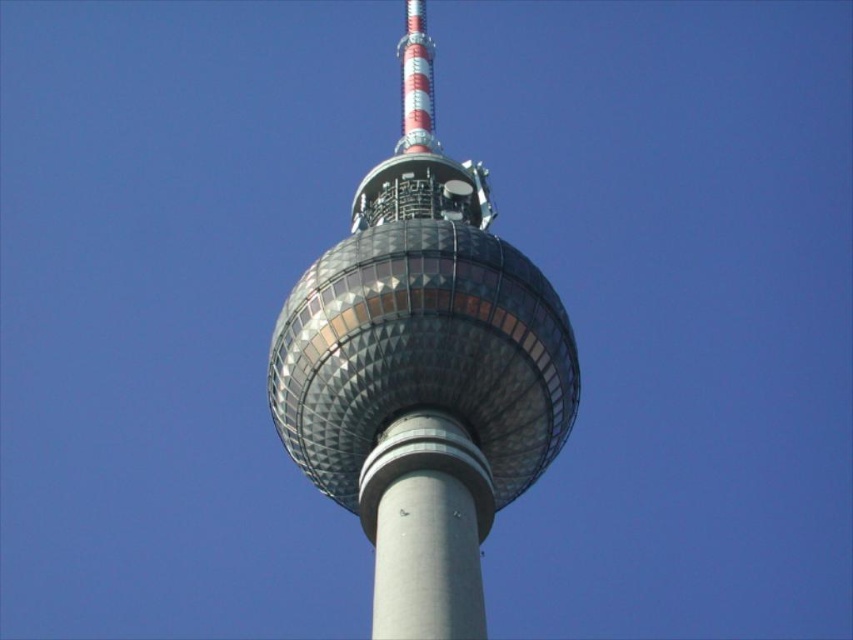
Does shiny glass sphere at center have a smaller size compared to gray concrete pole at center?

Incorrect, shiny glass sphere at center is not smaller in size than gray concrete pole at center.

The image size is (853, 640). Identify the location of shiny glass sphere at center. (422, 371).

Is point (393, 618) in front of point (369, 496)?

That is True.

Where is `shiny glass sphere at center`? Image resolution: width=853 pixels, height=640 pixels. shiny glass sphere at center is located at coordinates (422, 371).